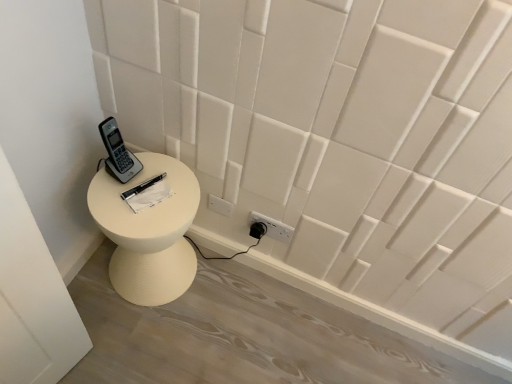
Question: Can you confirm if gray plastic phone at upper left is taller than white matte side table at lower left?

Choices:
 (A) no
 (B) yes

Answer: (A)

Question: Is gray plastic phone at upper left located outside white matte side table at lower left?

Choices:
 (A) no
 (B) yes

Answer: (B)

Question: Is gray plastic phone at upper left smaller than white matte side table at lower left?

Choices:
 (A) yes
 (B) no

Answer: (A)

Question: Is gray plastic phone at upper left thinner than white matte side table at lower left?

Choices:
 (A) yes
 (B) no

Answer: (A)

Question: Is gray plastic phone at upper left wider than white matte side table at lower left?

Choices:
 (A) no
 (B) yes

Answer: (A)

Question: Is gray plastic phone at upper left to the right of white matte side table at lower left from the viewer's perspective?

Choices:
 (A) no
 (B) yes

Answer: (A)

Question: Is gray plastic phone at upper left taller than white paper at center?

Choices:
 (A) no
 (B) yes

Answer: (B)

Question: From the image's perspective, is gray plastic phone at upper left above white paper at center?

Choices:
 (A) no
 (B) yes

Answer: (B)

Question: Is gray plastic phone at upper left completely or partially outside of white paper at center?

Choices:
 (A) no
 (B) yes

Answer: (B)

Question: From a real-world perspective, is gray plastic phone at upper left beneath white paper at center?

Choices:
 (A) yes
 (B) no

Answer: (B)

Question: Considering the relative sizes of gray plastic phone at upper left and white paper at center in the image provided, is gray plastic phone at upper left shorter than white paper at center?

Choices:
 (A) yes
 (B) no

Answer: (B)

Question: Is gray plastic phone at upper left thinner than white paper at center?

Choices:
 (A) yes
 (B) no

Answer: (A)

Question: Is white matte side table at lower left directly adjacent to gray plastic phone at upper left?

Choices:
 (A) no
 (B) yes

Answer: (A)